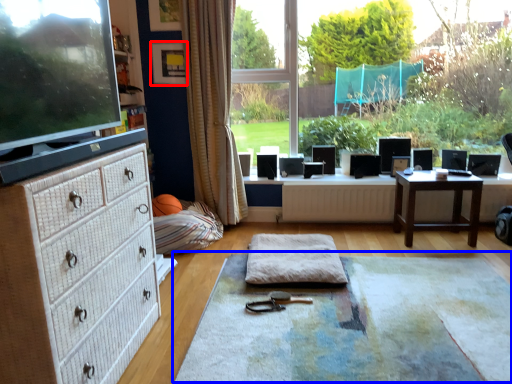
Question: Which point is further to the camera, picture frame (highlighted by a red box) or yoga mat (highlighted by a blue box)?

Choices:
 (A) picture frame
 (B) yoga mat

Answer: (A)